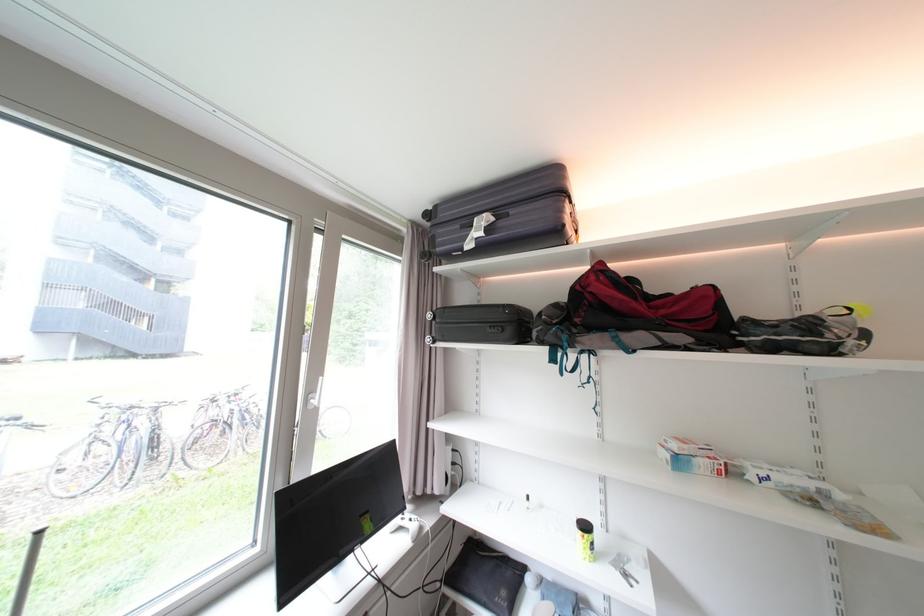
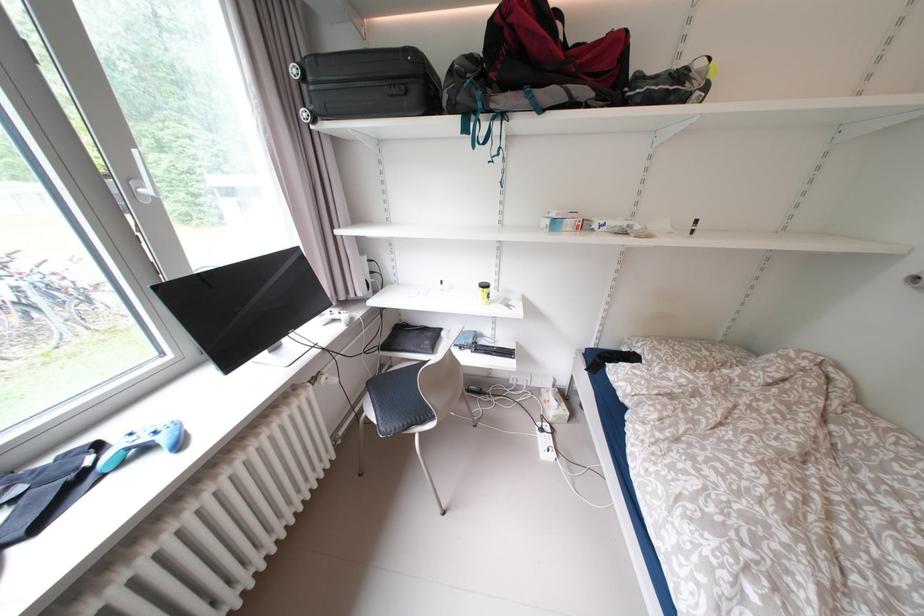
The images are taken continuously from a first-person perspective. In which direction is your viewpoint rotating?

The camera's rotation is toward right-down.